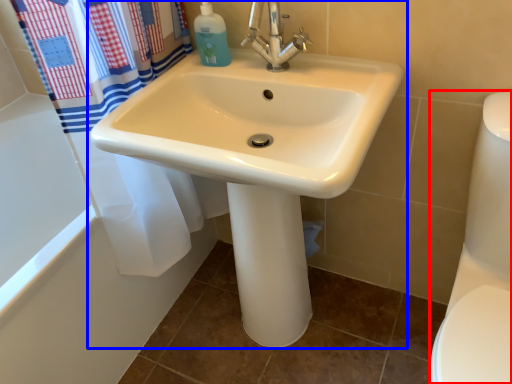
Question: Which of the following is the closest to the observer, toilet bowl (highlighted by a red box) or sink (highlighted by a blue box)?

Choices:
 (A) toilet bowl
 (B) sink

Answer: (A)